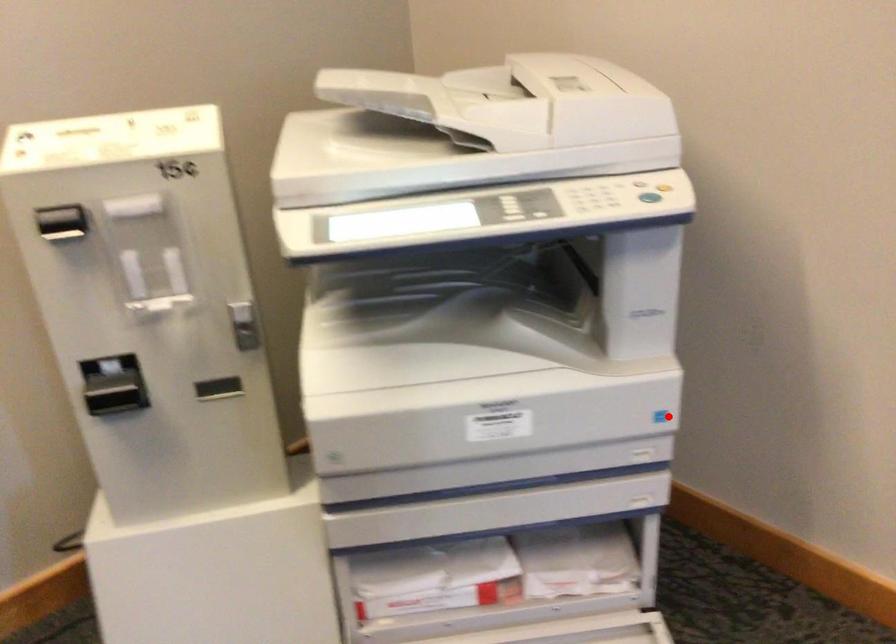
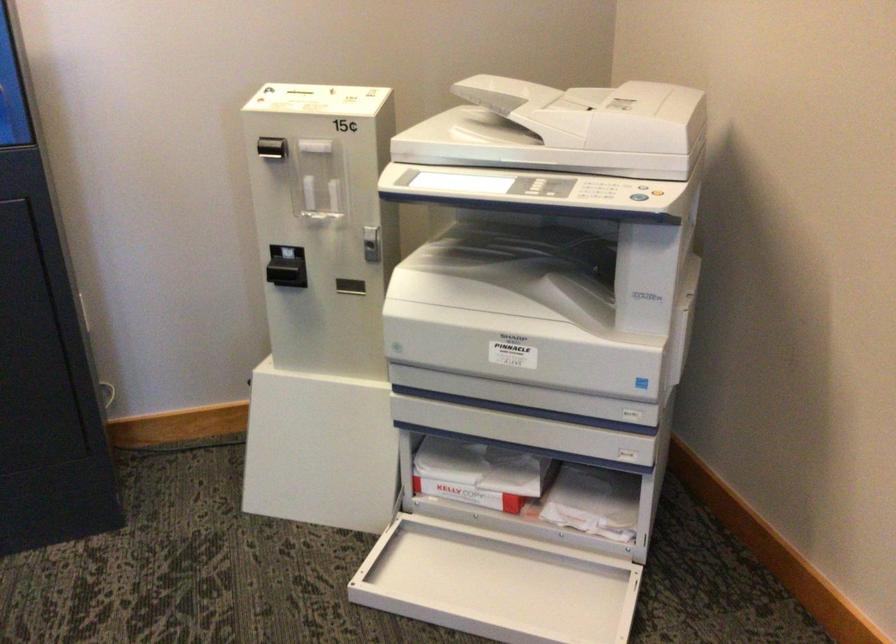
Question: A red point is marked in image1. In image2, is the corresponding 3D point closer to the camera or farther? Reply with the corresponding letter.

Choices:
 (A) The corresponding 3D point is closer.
 (B) The corresponding 3D point is farther.

Answer: (B)